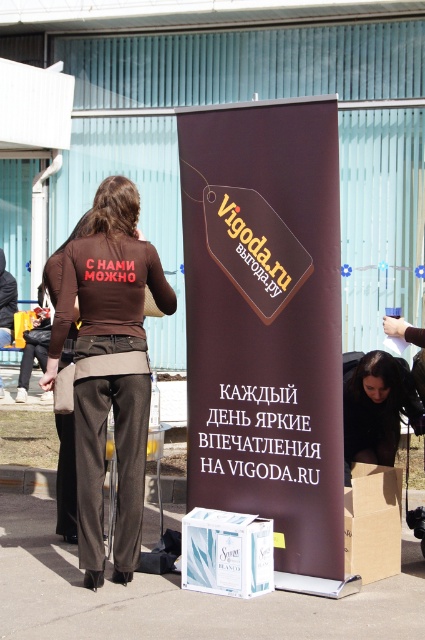
Question: Is black matte hair at lower center above brown cardboard box at lower right?

Choices:
 (A) yes
 (B) no

Answer: (A)

Question: Which object appears farthest from the camera in this image?

Choices:
 (A) brown fabric shirt at center
 (B) brown cardboard box at lower right
 (C) black matte hair at lower center

Answer: (C)

Question: Can you confirm if brown fabric shirt at center is positioned to the right of white glossy box at lower center?

Choices:
 (A) no
 (B) yes

Answer: (A)

Question: Does white glossy box at lower center have a greater width compared to brown cardboard box at lower right?

Choices:
 (A) yes
 (B) no

Answer: (A)

Question: Among these objects, which one is nearest to the camera?

Choices:
 (A) white glossy box at lower center
 (B) brown cardboard box at lower right
 (C) brown matte banner at center
 (D) black matte hair at lower center

Answer: (C)

Question: Which object is closer to the camera taking this photo?

Choices:
 (A) white glossy box at lower center
 (B) brown fabric shirt at center
 (C) brown matte banner at center

Answer: (C)